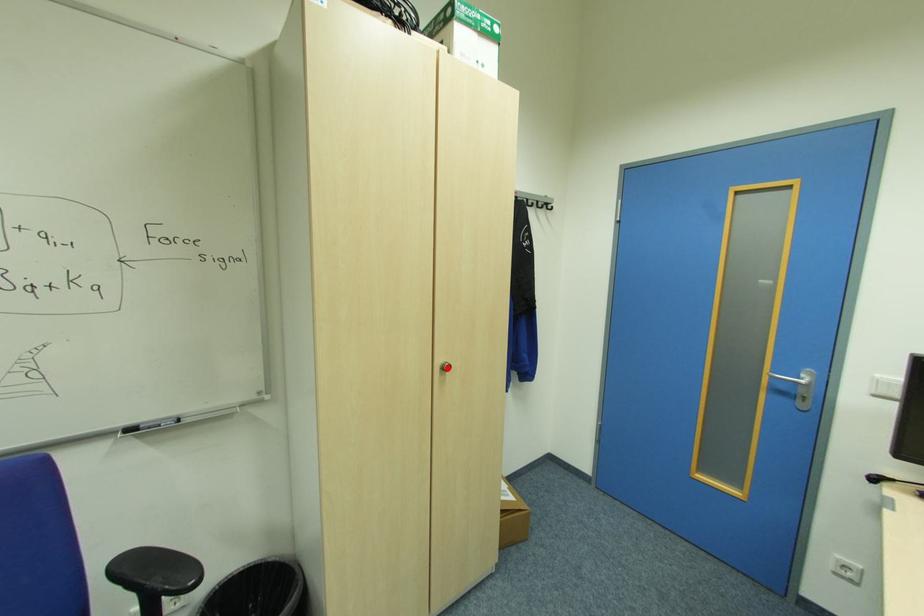
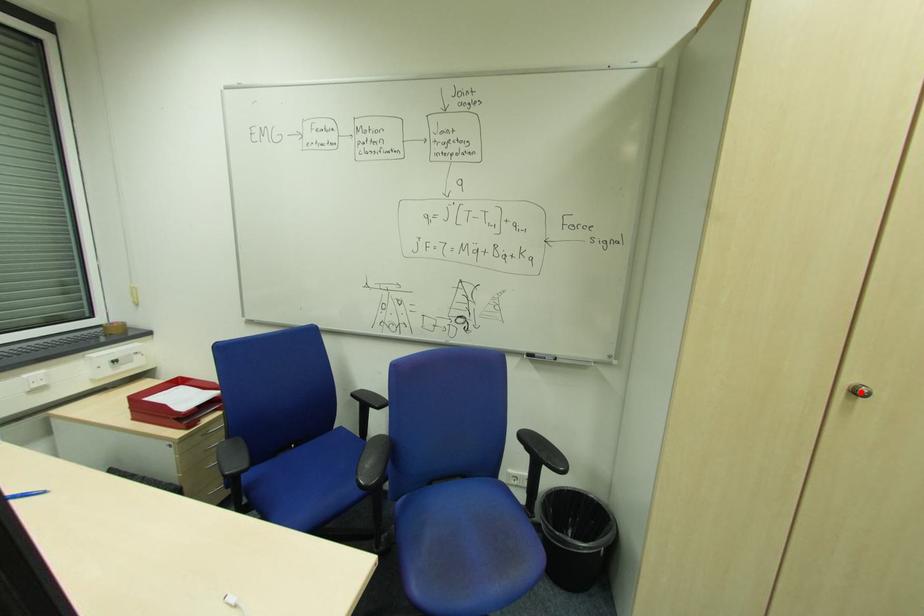
I am providing you with two images of the same scene from different viewpoints. A red point is marked on the first image and another point is marked on the second image. Are the points marked in image1 and image2 representing the same 3D position?

Yes